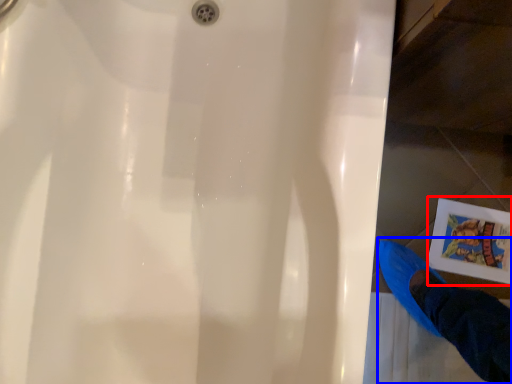
Question: Which point is further to the camera, comic book (highlighted by a red box) or person (highlighted by a blue box)?

Choices:
 (A) comic book
 (B) person

Answer: (A)